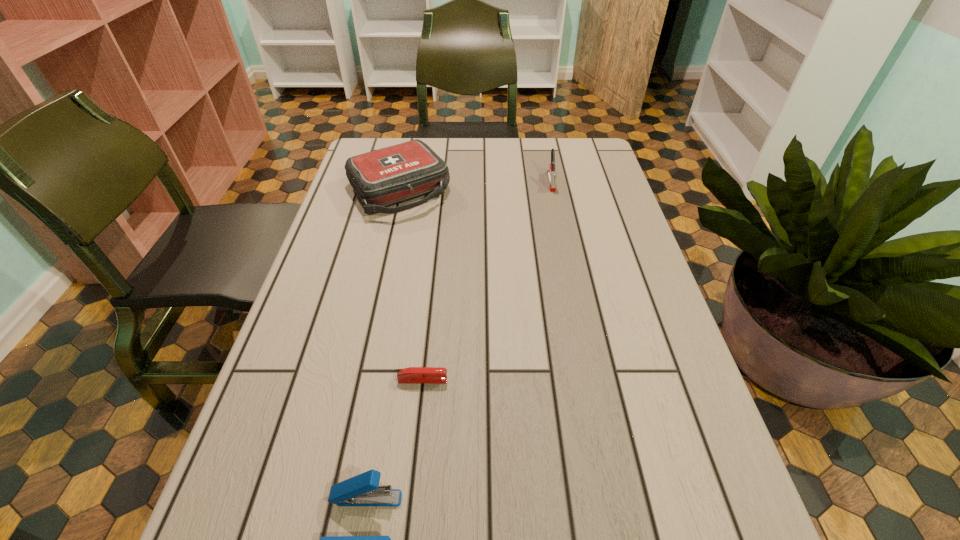
I want to click on the first-aid kit, so click(387, 176).

You are a GUI agent. You are given a task and a screenshot of the screen. Output one action in this format:
    pyautogui.click(x=<x>, y=<y>)
    Task: Click on the farthest stapler
    This screenshot has width=960, height=540.
    Given the screenshot: What is the action you would take?
    pyautogui.click(x=552, y=174)

Find the location of a particular element. The height and width of the screenshot is (540, 960). the rightmost stapler is located at coordinates (552, 174).

Where is `the second farthest stapler`? the second farthest stapler is located at coordinates (412, 375).

At what (x,y) coordinates should I click in order to perform the action: click on the shortest object. Please return your answer as a coordinate pair (x, y). Image resolution: width=960 pixels, height=540 pixels. Looking at the image, I should click on (412, 375).

I want to click on free space located on the back of the first-aid kit, so pyautogui.click(x=409, y=146).

Identify the location of vacant space located 0.370m on the handle side of the rightmost object. This screenshot has width=960, height=540. (572, 283).

Locate an element on the screen. free space located on the front-facing side of the shortest object is located at coordinates (642, 380).

This screenshot has height=540, width=960. What are the coordinates of `the first-aid kit located at the far edge` in the screenshot? It's located at (387, 176).

Identify the location of stapler that is at the far edge. (552, 174).